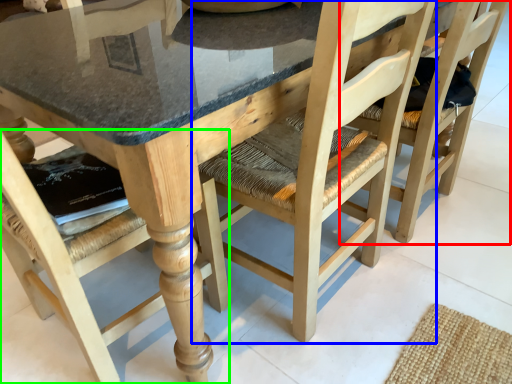
Question: Considering the real-world distances, which object is closest to chair (highlighted by a red box)? chair (highlighted by a blue box) or chair (highlighted by a green box).

Choices:
 (A) chair
 (B) chair

Answer: (A)